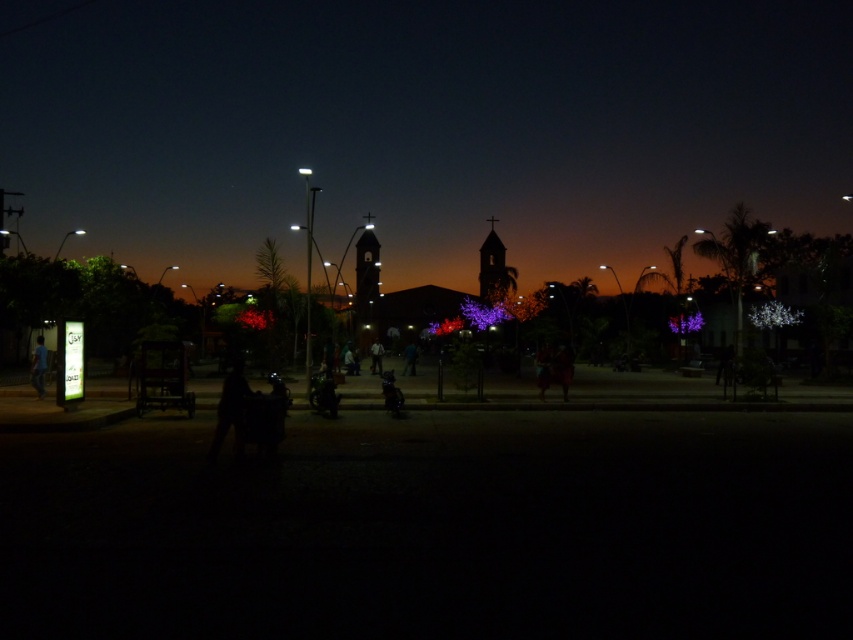
Question: Can you confirm if matte glass bell tower at center is thinner than matte brown bell tower at center?

Choices:
 (A) yes
 (B) no

Answer: (B)

Question: Considering the relative positions of matte glass bell tower at center and blue fabric person at lower left in the image provided, where is matte glass bell tower at center located with respect to blue fabric person at lower left?

Choices:
 (A) right
 (B) left

Answer: (B)

Question: Which object is farther from the camera taking this photo?

Choices:
 (A) blue fabric person at lower left
 (B) matte brown bell tower at center

Answer: (B)

Question: Considering the real-world distances, which object is farthest from the matte glass bell tower at center?

Choices:
 (A) matte brown bell tower at center
 (B) blue fabric person at lower left

Answer: (B)

Question: Which object is closer to the camera taking this photo?

Choices:
 (A) matte brown bell tower at center
 (B) matte glass bell tower at center
 (C) blue fabric person at lower left

Answer: (C)

Question: Considering the relative positions of matte glass bell tower at center and blue fabric person at lower left in the image provided, where is matte glass bell tower at center located with respect to blue fabric person at lower left?

Choices:
 (A) right
 (B) left

Answer: (B)